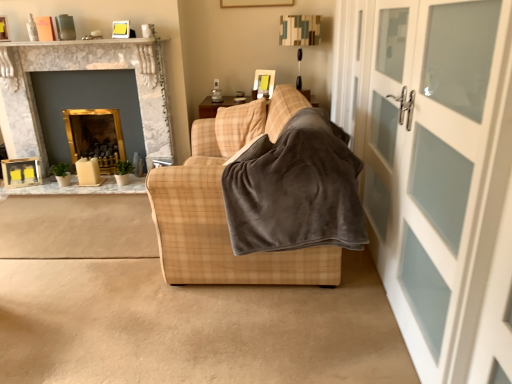
What do you see at coordinates (224, 207) in the screenshot? This screenshot has height=384, width=512. I see `plaid fabric couch at center` at bounding box center [224, 207].

The width and height of the screenshot is (512, 384). Describe the element at coordinates (84, 42) in the screenshot. I see `white marble fireplace at upper center` at that location.

What do you see at coordinates (438, 168) in the screenshot?
I see `white frosted glass door at right` at bounding box center [438, 168].

I want to click on white frosted glass door at right, so click(x=438, y=168).

This screenshot has width=512, height=384. I want to click on plaid fabric couch at center, so click(224, 207).

Which object is wider, white marble fireplace at upper center or plaid fabric couch at center?

Wider between the two is plaid fabric couch at center.

Is white marble fireplace at upper center not close to plaid fabric couch at center?

Yes.

Can you confirm if white marble fireplace at upper center is positioned to the left of plaid fabric couch at center?

Correct, you'll find white marble fireplace at upper center to the left of plaid fabric couch at center.

From the image's perspective, who appears lower, white marble fireplace at upper center or wooden table at left?

From the image's view, wooden table at left is below.

Considering the relative sizes of white marble fireplace at upper center and wooden table at left in the image provided, is white marble fireplace at upper center smaller than wooden table at left?

Answer: Yes, white marble fireplace at upper center is smaller than wooden table at left.

Looking at their sizes, would you say white marble fireplace at upper center is wider or thinner than wooden table at left?

Considering their sizes, white marble fireplace at upper center looks slimmer than wooden table at left.

Does plaid fabric couch at center have a lesser width compared to wooden table at left?

No, plaid fabric couch at center is not thinner than wooden table at left.

Is plaid fabric couch at center to the right of wooden table at left from the viewer's perspective?

Yes, plaid fabric couch at center is to the right of wooden table at left.

From the picture: From the image's perspective, is plaid fabric couch at center on wooden table at left?

Yes, from the image's perspective, plaid fabric couch at center is over wooden table at left.

What are the coordinates of `table on the left of the white frosted glass door at right` in the screenshot? It's located at (79, 187).

Is wooden table at left taller than white frosted glass door at right?

No, wooden table at left is not taller than white frosted glass door at right.

Is wooden table at left touching white frosted glass door at right?

No, wooden table at left is not touching white frosted glass door at right.

From the image's perspective, is white frosted glass door at right above or below white marble fireplace at upper center?

white frosted glass door at right is below white marble fireplace at upper center.

Which is more to the left, white frosted glass door at right or white marble fireplace at upper center?

white marble fireplace at upper center is more to the left.

Locate an element on the screen. mantle on the left of white frosted glass door at right is located at coordinates tap(84, 42).

Consider the image. Is plaid fabric couch at center situated inside gray fleece blanket at center or outside?

plaid fabric couch at center lies outside gray fleece blanket at center.

Considering the sizes of plaid fabric couch at center and gray fleece blanket at center in the image, is plaid fabric couch at center taller or shorter than gray fleece blanket at center?

Clearly, plaid fabric couch at center is taller compared to gray fleece blanket at center.

From the image's perspective, which is below, plaid fabric couch at center or gray fleece blanket at center?

From the image's view, gray fleece blanket at center is below.

Looking at their sizes, would you say plaid fabric couch at center is wider or thinner than gray fleece blanket at center?

Considering their sizes, plaid fabric couch at center looks broader than gray fleece blanket at center.

From a real-world perspective, does gold marble fireplace at upper left sit lower than white marble fireplace at upper center?

Correct, in the physical world, gold marble fireplace at upper left is lower than white marble fireplace at upper center.

Consider the image. Is gold marble fireplace at upper left aimed at white marble fireplace at upper center?

No, gold marble fireplace at upper left does not turn towards white marble fireplace at upper center.

Is gold marble fireplace at upper left to the left of white marble fireplace at upper center from the viewer's perspective?

Indeed, gold marble fireplace at upper left is positioned on the left side of white marble fireplace at upper center.

You are a GUI agent. You are given a task and a screenshot of the screen. Output one action in this format:
    pyautogui.click(x=<x>, y=<y>)
    Task: Click on the mantle behind the plaid fabric couch at center
    The image size is (512, 384).
    Given the screenshot: What is the action you would take?
    pyautogui.click(x=84, y=42)

At what (x,y) coordinates should I click in order to perform the action: click on mantle that is above the wooden table at left (from a real-world perspective). Please return your answer as a coordinate pair (x, y). Looking at the image, I should click on (84, 42).

From the image, which object appears to be nearer to gold marble fireplace at upper left, plaid fabric couch at center or white marble fireplace at upper center?

white marble fireplace at upper center lies closer to gold marble fireplace at upper left than the other object.

Based on their spatial positions, is gold marble fireplace at upper left or plaid fabric couch at center further from gray fleece blanket at center?

The object further to gray fleece blanket at center is gold marble fireplace at upper left.

When comparing their distances from gold marble fireplace at upper left, does wooden table at left or white frosted glass door at right seem closer?

wooden table at left is closer to gold marble fireplace at upper left.

Estimate the real-world distances between objects in this image. Which object is further from white marble fireplace at upper center, gray fleece blanket at center or white frosted glass door at right?

white frosted glass door at right is positioned further to the anchor white marble fireplace at upper center.

Estimate the real-world distances between objects in this image. Which object is closer to gold marble fireplace at upper left, wooden table at left or white marble fireplace at upper center?

white marble fireplace at upper center lies closer to gold marble fireplace at upper left than the other object.

Which object lies nearer to the anchor point white marble fireplace at upper center, wooden table at left or plaid fabric couch at center?

The object closer to white marble fireplace at upper center is wooden table at left.

Estimate the real-world distances between objects in this image. Which object is further from white frosted glass door at right, wooden table at left or white marble fireplace at upper center?

Based on the image, white marble fireplace at upper center appears to be further to white frosted glass door at right.

Considering their positions, is white frosted glass door at right positioned further to gold marble fireplace at upper left than plaid fabric couch at center?

white frosted glass door at right lies further to gold marble fireplace at upper left than the other object.

The image size is (512, 384). In order to click on mantle located between white frosted glass door at right and wooden table at left in the depth direction in this screenshot , I will do `click(84, 42)`.

Identify the location of studio couch between white frosted glass door at right and wooden table at left in the front-back direction. (224, 207).

Image resolution: width=512 pixels, height=384 pixels. I want to click on mantle located between wooden table at left and gray fleece blanket at center in the left-right direction, so click(x=84, y=42).

In order to click on studio couch between white marble fireplace at upper center and gray fleece blanket at center in this screenshot , I will do `click(224, 207)`.